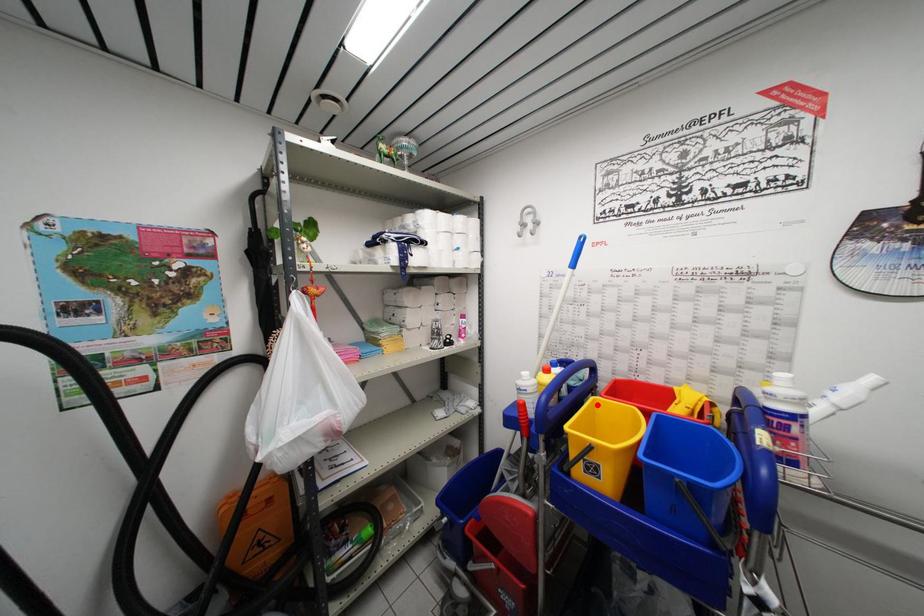
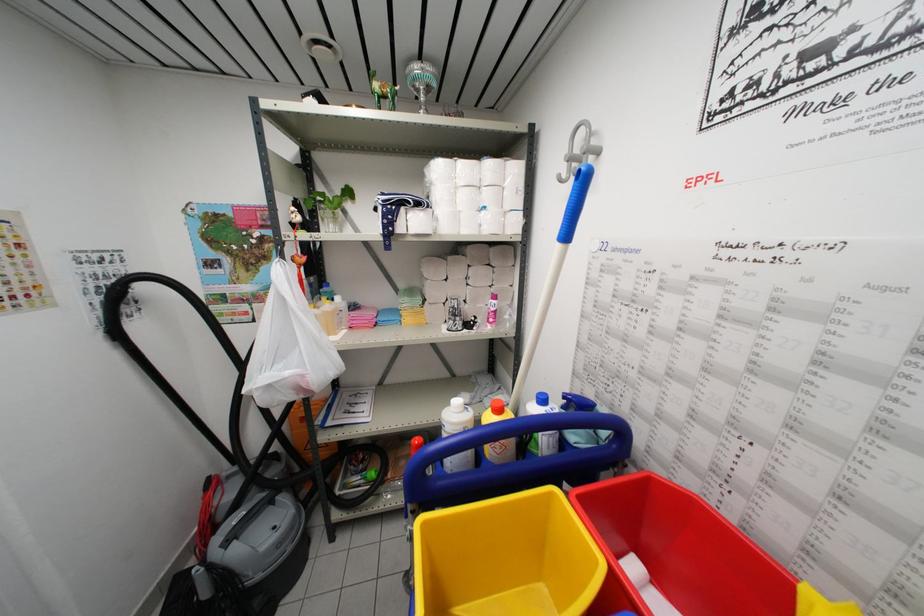
The point at the highlighted location is marked in the first image. Where is the corresponding point in the second image?

(554, 498)